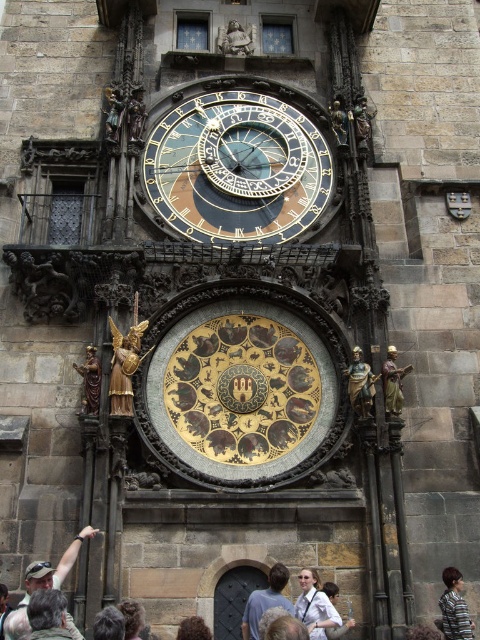
Question: Which point appears farthest from the camera in this image?

Choices:
 (A) (460, 630)
 (B) (31, 621)
 (C) (358, 401)
 (D) (192, 636)

Answer: (C)

Question: Does dark brown hair at lower left have a larger size compared to striped fabric shirt at lower right?

Choices:
 (A) yes
 (B) no

Answer: (B)

Question: Is white cotton shirt at center below gold polished statue at right?

Choices:
 (A) no
 (B) yes

Answer: (B)

Question: Can you confirm if gold metallic clock at upper center is thinner than light brown leather jacket at center?

Choices:
 (A) yes
 (B) no

Answer: (B)

Question: Which of the following is the closest to the observer?

Choices:
 (A) (196, 634)
 (B) (260, 595)

Answer: (A)

Question: Which of the following is the closest to the observer?

Choices:
 (A) (399, 388)
 (B) (268, 572)

Answer: (B)